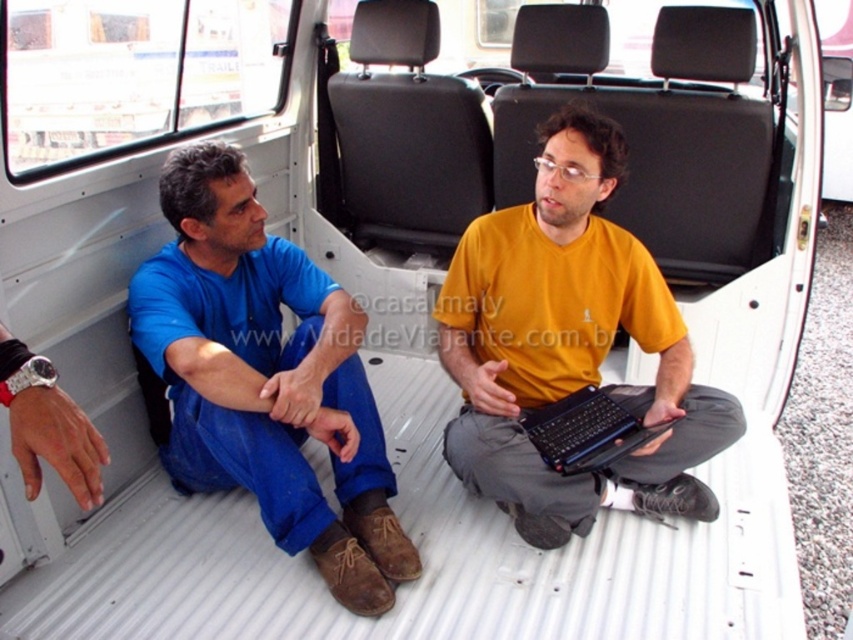
Is blue denim jeans at lower left taller than yellow matte shirt at center?

In fact, blue denim jeans at lower left may be shorter than yellow matte shirt at center.

Which is below, blue denim jeans at lower left or yellow matte shirt at center?

Positioned lower is blue denim jeans at lower left.

Which is in front, point (302, 326) or point (480, 371)?

Point (480, 371)

At what (x,y) coordinates should I click in order to perform the action: click on blue denim jeans at lower left. Please return your answer as a coordinate pair (x, y). The width and height of the screenshot is (853, 640). Looking at the image, I should click on (265, 378).

Is yellow matte shirt at center positioned in front of black plastic laptop at center?

Yes, it is in front of black plastic laptop at center.

Does yellow matte shirt at center have a greater height compared to black plastic laptop at center?

Indeed, yellow matte shirt at center has a greater height compared to black plastic laptop at center.

Is point (587, 218) positioned in front of point (614, 401)?

Yes, it is in front of point (614, 401).

At what (x,y) coordinates should I click in order to perform the action: click on yellow matte shirt at center. Please return your answer as a coordinate pair (x, y). This screenshot has height=640, width=853. Looking at the image, I should click on (569, 342).

How much distance is there between blue denim jeans at lower left and black plastic laptop at center?

A distance of 24.15 inches exists between blue denim jeans at lower left and black plastic laptop at center.

Which is behind, point (270, 456) or point (585, 435)?

Positioned behind is point (585, 435).

Image resolution: width=853 pixels, height=640 pixels. Find the location of `blue denim jeans at lower left`. blue denim jeans at lower left is located at coordinates (265, 378).